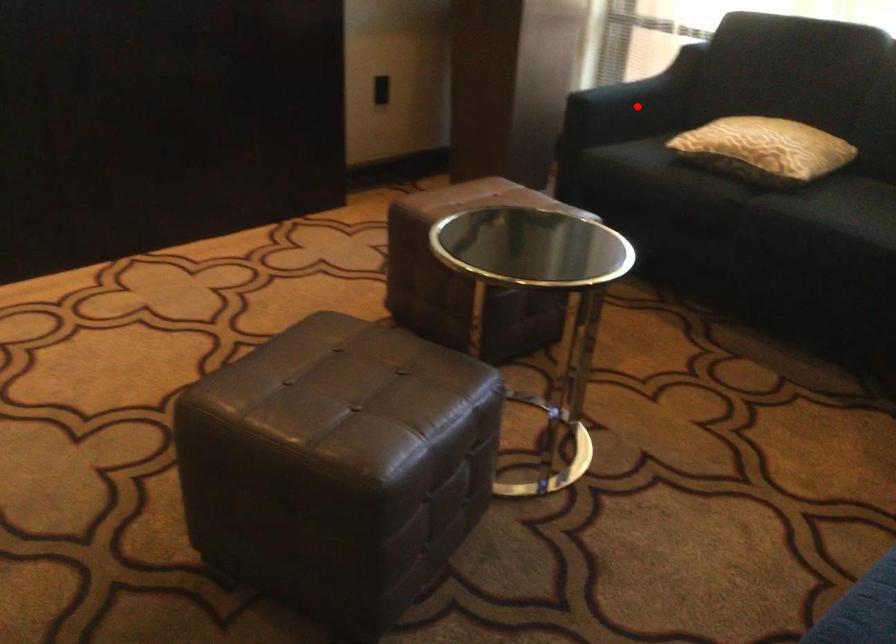
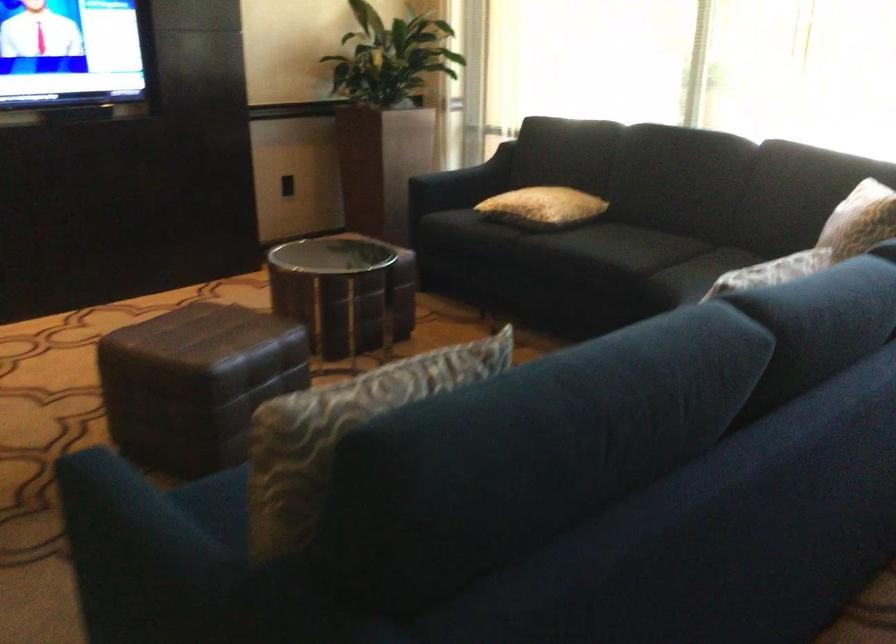
Where in the second image is the point corresponding to the highlighted location from the first image?

(460, 184)